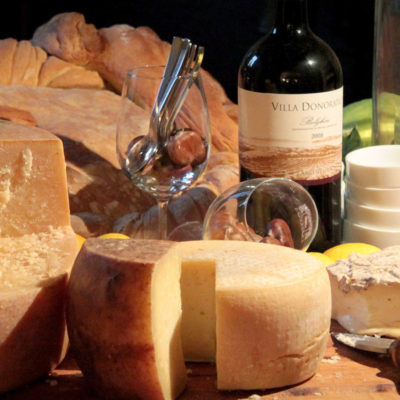
The image size is (400, 400). Identify the location of glass. (175, 181).